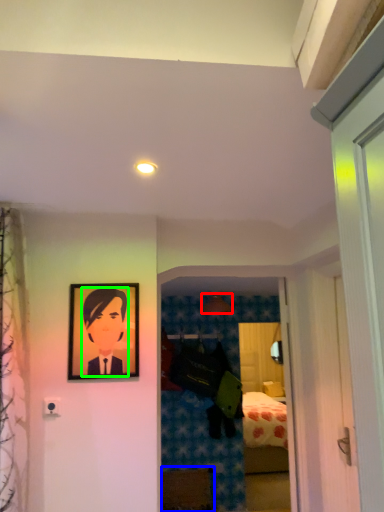
Question: Based on their relative distances, which object is nearer to lamp (highlighted by a red box)? Choose from furniture (highlighted by a blue box) and person (highlighted by a green box).

Choices:
 (A) furniture
 (B) person

Answer: (A)